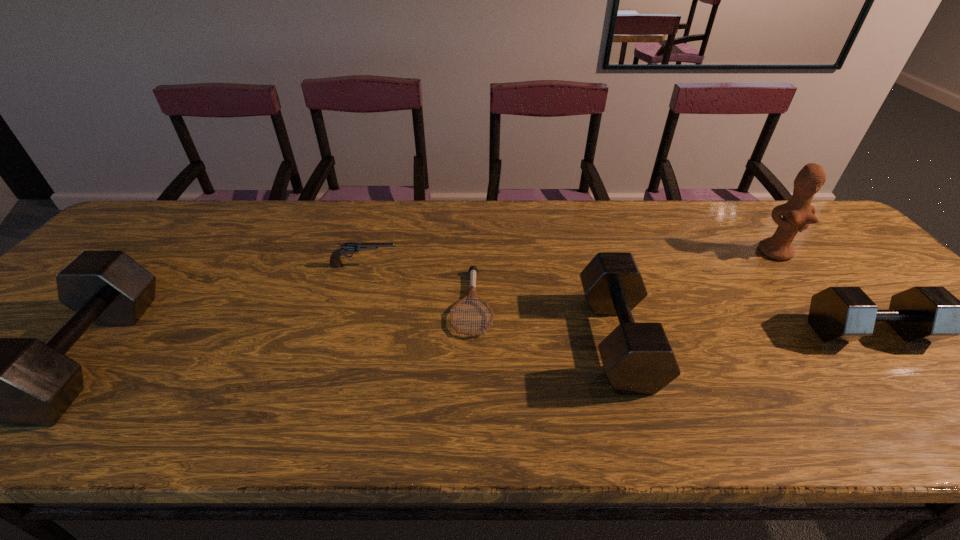
Please point a location where one more dumbbell can be added evenly. Please provide its 2D coordinates. Your answer should be formatted as a tuple, i.e. [(x, y)], where the tuple contains the x and y coordinates of a point satisfying the conditions above.

[(359, 347)]